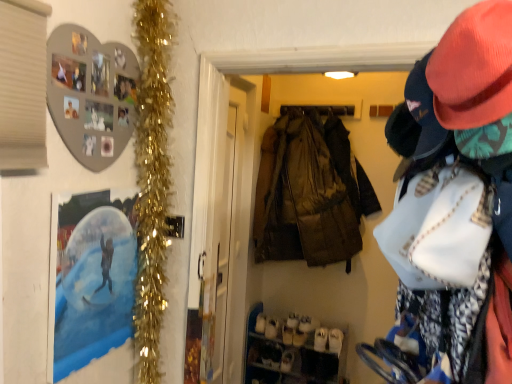
Question: From the image's perspective, would you say transparent plastic screen door at center is positioned over matte pink hat at upper right?

Choices:
 (A) no
 (B) yes

Answer: (A)

Question: Considering the relative sizes of transparent plastic screen door at center and matte pink hat at upper right in the image provided, is transparent plastic screen door at center smaller than matte pink hat at upper right?

Choices:
 (A) no
 (B) yes

Answer: (B)

Question: Is the position of transparent plastic screen door at center more distant than that of matte pink hat at upper right?

Choices:
 (A) no
 (B) yes

Answer: (B)

Question: Considering the relative sizes of transparent plastic screen door at center and matte pink hat at upper right in the image provided, is transparent plastic screen door at center bigger than matte pink hat at upper right?

Choices:
 (A) yes
 (B) no

Answer: (B)

Question: Does transparent plastic screen door at center contain matte pink hat at upper right?

Choices:
 (A) yes
 (B) no

Answer: (B)

Question: Visually, is white suede shoe at lower center, which is the second shoe from left to right, positioned to the left or to the right of matte pink hat at upper right?

Choices:
 (A) right
 (B) left

Answer: (B)

Question: In the image, is white suede shoe at lower center, which is the second shoe from left to right, positioned in front of or behind matte pink hat at upper right?

Choices:
 (A) behind
 (B) front

Answer: (A)

Question: From the image's perspective, is white suede shoe at lower center, the first shoe viewed from the right, located above or below matte pink hat at upper right?

Choices:
 (A) below
 (B) above

Answer: (A)

Question: From a real-world perspective, is white suede shoe at lower center, the first shoe viewed from the right, positioned above or below matte pink hat at upper right?

Choices:
 (A) below
 (B) above

Answer: (A)

Question: In the image, is camouflage fabric jacket at center positioned in front of or behind white suede shoe at lower center, which is the second shoe from left to right?

Choices:
 (A) behind
 (B) front

Answer: (B)

Question: Do you think camouflage fabric jacket at center is within white suede shoe at lower center, the first shoe viewed from the right, or outside of it?

Choices:
 (A) inside
 (B) outside

Answer: (B)

Question: Considering the positions of camouflage fabric jacket at center and white suede shoe at lower center, which is the second shoe from left to right, in the image, is camouflage fabric jacket at center wider or thinner than white suede shoe at lower center, which is the second shoe from left to right,?

Choices:
 (A) thin
 (B) wide

Answer: (B)

Question: From the image's perspective, is camouflage fabric jacket at center above or below white suede shoe at lower center, which is the second shoe from left to right?

Choices:
 (A) below
 (B) above

Answer: (B)

Question: Is gold tinsel garland at left wider or thinner than camouflage fabric jacket at center?

Choices:
 (A) thin
 (B) wide

Answer: (A)

Question: Based on their positions, is gold tinsel garland at left located to the left or right of camouflage fabric jacket at center?

Choices:
 (A) right
 (B) left

Answer: (B)